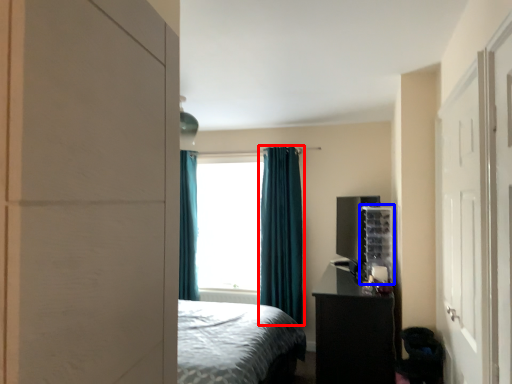
Question: Among these objects, which one is nearest to the camera, curtain (highlighted by a red box) or shelf (highlighted by a blue box)?

Choices:
 (A) curtain
 (B) shelf

Answer: (B)